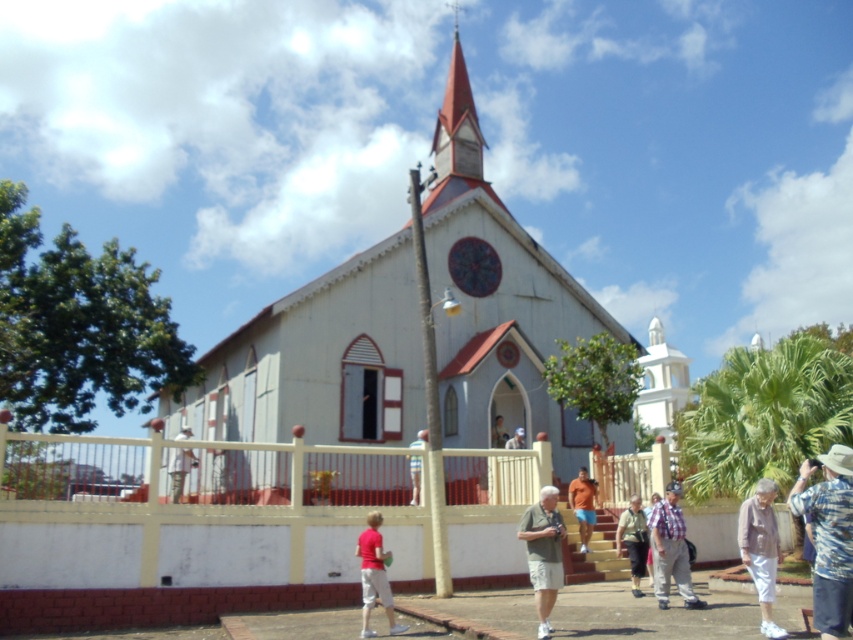
Question: Can you confirm if green fabric shirt at center is positioned above light brown wooden fence at center?

Choices:
 (A) no
 (B) yes

Answer: (B)

Question: Which point is closer to the camera?

Choices:
 (A) light brown leather jacket at center
 (B) green fabric shirt at center
 (C) white wooden chapel at center

Answer: (B)

Question: Can you confirm if light brown leather jacket at lower center is positioned to the left of orange fabric shorts at center?

Choices:
 (A) yes
 (B) no

Answer: (B)

Question: Which object is the farthest from the light brown wooden chair at center?

Choices:
 (A) white wooden chapel at center
 (B) light brown leather jacket at center
 (C) orange fabric shorts at center
 (D) plaid shirt at center

Answer: (D)

Question: Can you confirm if white wooden chapel at center is wider than plaid shirt at center?

Choices:
 (A) no
 (B) yes

Answer: (B)

Question: Which of the following is the closest to the observer?

Choices:
 (A) light brown wooden chair at center
 (B) light brown leather jacket at lower center
 (C) multicolored stained glass window at center
 (D) light brown wooden fence at center

Answer: (B)